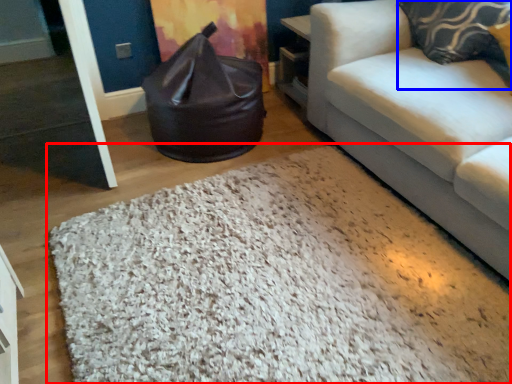
Question: Which point is further to the camera, mat (highlighted by a red box) or pillow (highlighted by a blue box)?

Choices:
 (A) mat
 (B) pillow

Answer: (B)